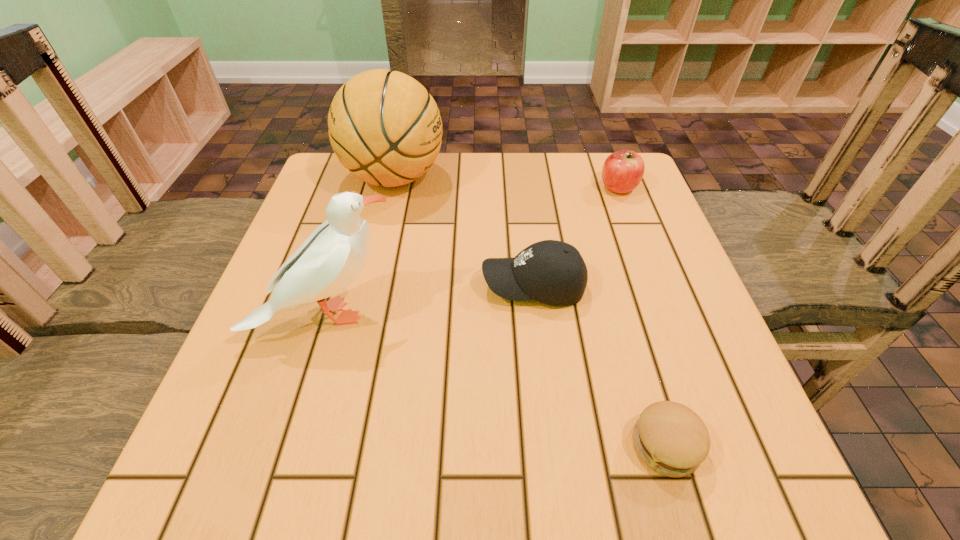
Identify the location of empty space between the apple and the baseball cap. (576, 237).

Where is `free area in between the basketball and the apple`? This screenshot has height=540, width=960. free area in between the basketball and the apple is located at coordinates (507, 183).

You are a GUI agent. You are given a task and a screenshot of the screen. Output one action in this format:
    pyautogui.click(x=<x>, y=<y>)
    Task: Click on the free point between the apple and the nearest object
    The image size is (960, 540).
    Given the screenshot: What is the action you would take?
    pyautogui.click(x=642, y=316)

You are a GUI agent. You are given a task and a screenshot of the screen. Output one action in this format:
    pyautogui.click(x=<x>, y=<y>)
    Task: Click on the empty space between the gull and the hamburger
    This screenshot has height=540, width=960.
    Given the screenshot: What is the action you would take?
    pyautogui.click(x=495, y=380)

The height and width of the screenshot is (540, 960). In order to click on free space between the gull and the nearest object in this screenshot , I will do `click(495, 380)`.

What are the coordinates of `unoccupied area between the basketball and the third object from right to left` in the screenshot? It's located at (464, 232).

Image resolution: width=960 pixels, height=540 pixels. Identify the location of vacant area between the gull and the baseball cap. (430, 300).

Where is `the second closest object relative to the apple`? Image resolution: width=960 pixels, height=540 pixels. the second closest object relative to the apple is located at coordinates (384, 126).

Choose which object is the nearest neighbor to the basketball. Please provide its 2D coordinates. Your answer should be formatted as a tuple, i.e. [(x, y)], where the tuple contains the x and y coordinates of a point satisfying the conditions above.

[(552, 272)]

In order to click on free location that satisfies the following two spatial constraints: 1. on the front-facing side of the shortest object; 2. on the right side of the third object from right to left in this screenshot , I will do `click(552, 446)`.